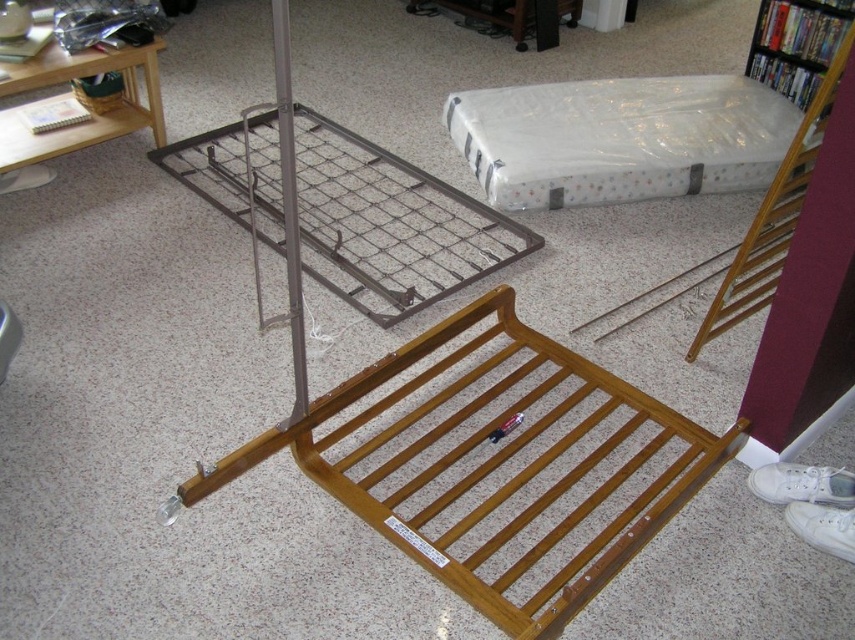
You are trying to place a new rug in the room. The rug you have is 1 meter wide. Where should you place it so that it doesn not interfere with the wooden slatted bed frame at center? Please provide coordinates based on the room layout described.

The wooden slatted bed frame at center is located at point (497, 465). To avoid interference, place the rug in an area away from this coordinate, ensuring the rug does not overlap with the bed frame. Since the rug is 1 meter wide, ensure there is sufficient space around the bed frame to accommodate its size without obstruction.

You are standing in the room and want to reach both points. Which point, point (716,460) or point (478,99), will you reach first if you move straight forward?

Point (716,460) is closer to the viewer than point (478,99), so you will reach point (716,460) first.

You are organizing a room and need to move the wooden bookshelf at upper right to the right side of the wooden slatted bed frame at center. Is this possible based on their current positions?

The wooden slatted bed frame at center is positioned on the left side of the wooden bookshelf at upper right, so moving the wooden bookshelf at upper right to the right side of the wooden slatted bed frame at center would require moving it further to the right, which may be possible depending on the room layout not specified here. However, based solely on their current spatial relationship, the bookshelf is already to the right of the bed frame.